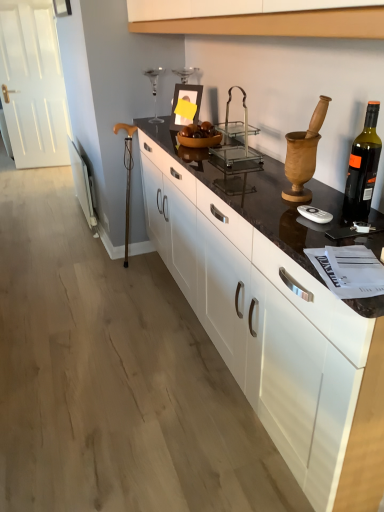
Question: Considering the positions of black glass bottle at right and clear glass trolley at center in the image, is black glass bottle at right taller or shorter than clear glass trolley at center?

Choices:
 (A) tall
 (B) short

Answer: (A)

Question: From the image's perspective, is black glass bottle at right located above or below clear glass trolley at center?

Choices:
 (A) below
 (B) above

Answer: (A)

Question: Which is farther from the black glass bottle at right?

Choices:
 (A) black marble countertop at center
 (B) clear glass trolley at center

Answer: (B)

Question: Estimate the real-world distances between objects in this image. Which object is closer to the black marble countertop at center?

Choices:
 (A) clear glass trolley at center
 (B) black glass bottle at right

Answer: (B)